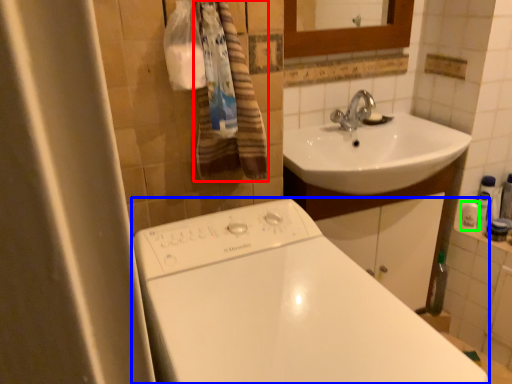
Question: Considering the real-world distances, which object is closest to bath towel (highlighted by a red box)? bathtub (highlighted by a blue box) or toiletry (highlighted by a green box).

Choices:
 (A) bathtub
 (B) toiletry

Answer: (A)